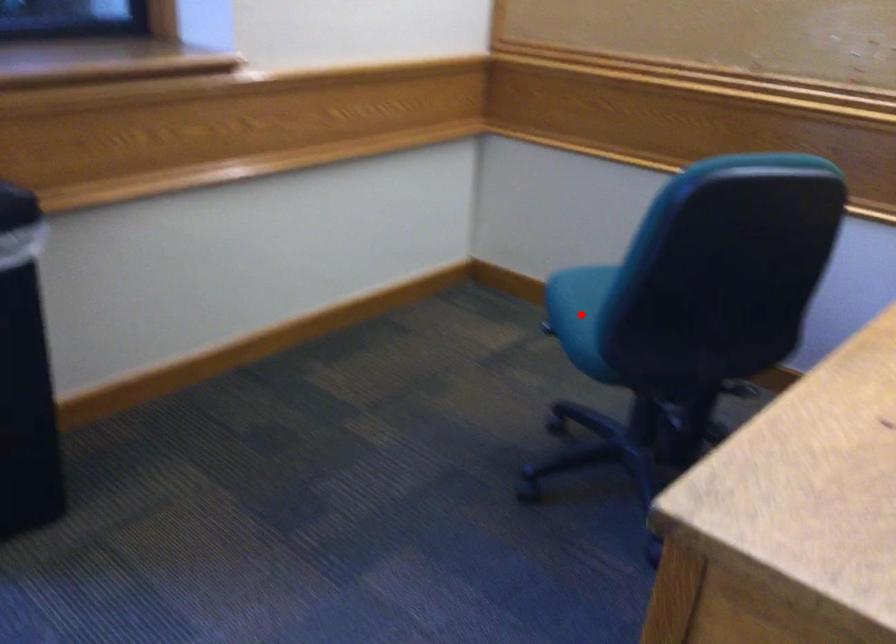
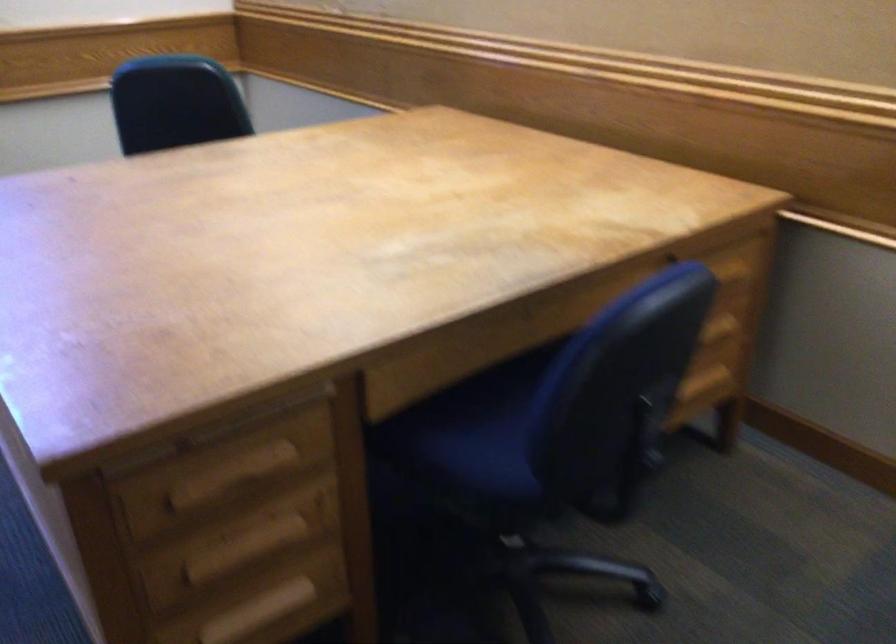
Question: I am providing you with two images of the same scene from different viewpoints. A red point is marked on the first image. Is the red point's position out of view in image 2?

Choices:
 (A) Yes
 (B) No

Answer: (A)